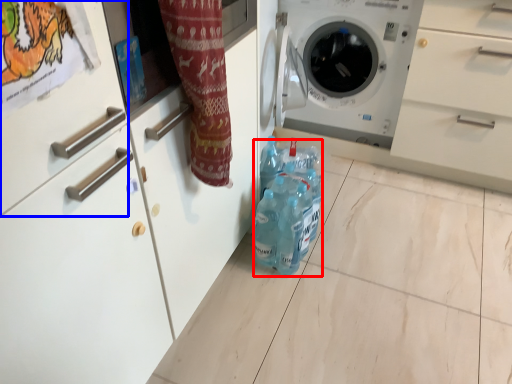
Question: Which object appears farthest to the camera in this image, bottle (highlighted by a red box) or drawer (highlighted by a blue box)?

Choices:
 (A) bottle
 (B) drawer

Answer: (A)